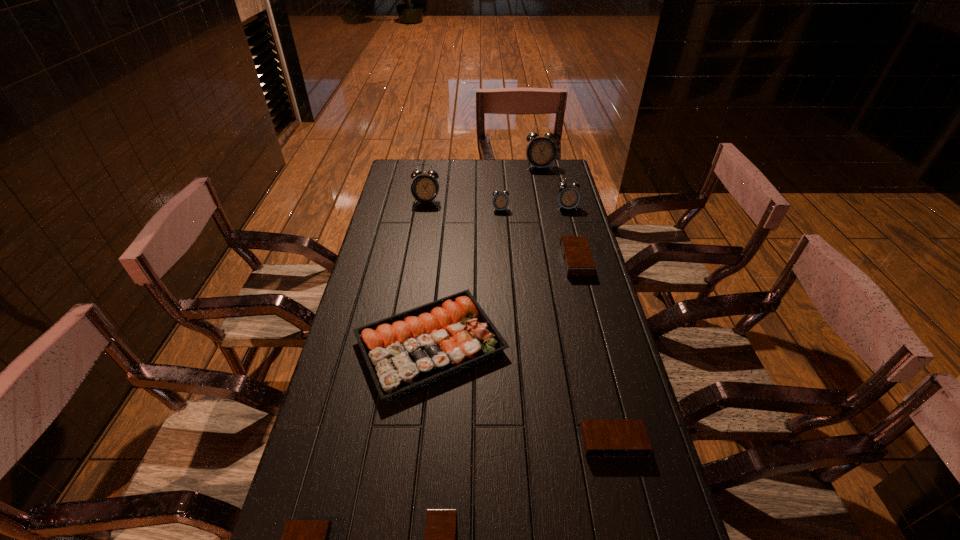
Locate an element on the screen. The width and height of the screenshot is (960, 540). free space between the platter and the second tallest alarm clock is located at coordinates (428, 273).

The height and width of the screenshot is (540, 960). What are the coordinates of `unoccupied position between the fourth nearest alarm clock and the second tallest alarm clock` in the screenshot? It's located at (501, 231).

This screenshot has width=960, height=540. What are the coordinates of `free area in between the fifth shortest alarm clock and the platter` in the screenshot? It's located at (466, 277).

Find the location of a particular element. vacant space that is in between the farthest object and the third white alarm clock from right to left is located at coordinates 519,188.

Identify the location of empty location between the biggest black alarm clock and the farthest alarm clock. This screenshot has width=960, height=540. (558, 214).

Find the location of a particular element. free area in between the platter and the second biggest white alarm clock is located at coordinates (428, 273).

Where is `vacant point located between the seventh tallest object and the smallest white alarm clock`? The width and height of the screenshot is (960, 540). vacant point located between the seventh tallest object and the smallest white alarm clock is located at coordinates (557, 326).

Choose which object is the second nearest neighbor to the fifth farthest object. Please provide its 2D coordinates. Your answer should be formatted as a tuple, i.e. [(x, y)], where the tuple contains the x and y coordinates of a point satisfying the conditions above.

[(410, 350)]

The image size is (960, 540). I want to click on object that ranks as the sixth closest to the smallest white alarm clock, so click(601, 437).

Locate which alarm clock ranks second in proximity to the platter. Please provide its 2D coordinates. Your answer should be formatted as a tuple, i.e. [(x, y)], where the tuple contains the x and y coordinates of a point satisfying the conditions above.

[(578, 262)]